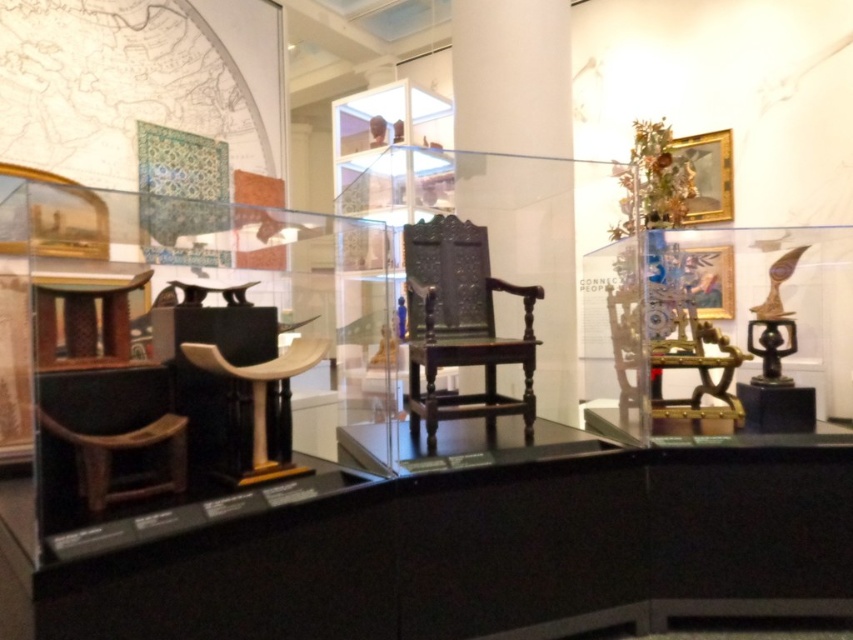
Can you confirm if dark wood carved chair at center is taller than wooden chair at center?

Yes, dark wood carved chair at center is taller than wooden chair at center.

Can you confirm if dark wood carved chair at center is positioned above wooden chair at center?

Yes.

Does point (410, 358) lie in front of point (328, 346)?

No, it is behind (328, 346).

Locate an element on the screen. This screenshot has width=853, height=640. dark wood carved chair at center is located at coordinates 460,324.